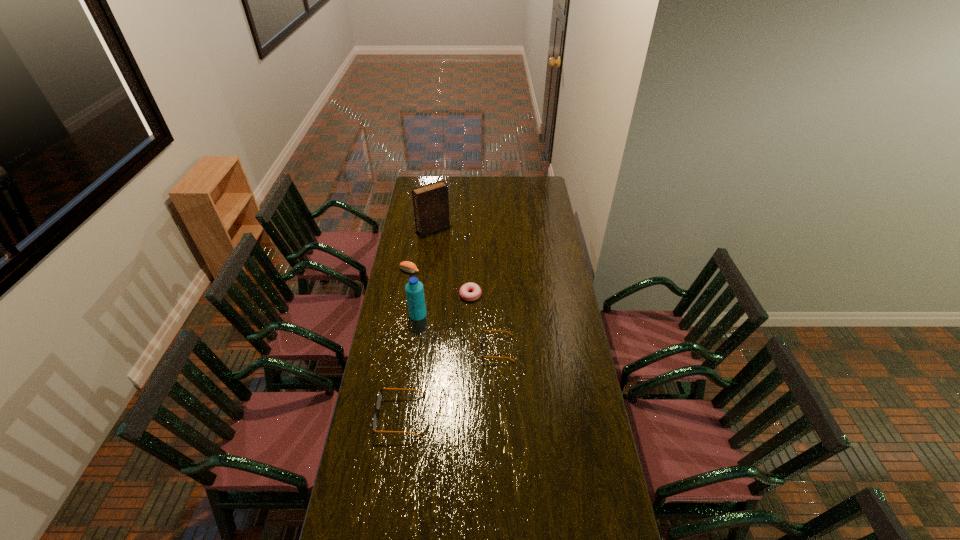
I want to click on empty space that is in between the Bible and the doughnut, so click(x=452, y=261).

You are a GUI agent. You are given a task and a screenshot of the screen. Output one action in this format:
    pyautogui.click(x=<x>, y=<y>)
    Task: Click on the vacant area that lies between the fourth farthest object and the third farthest object
    This screenshot has height=540, width=960.
    Given the screenshot: What is the action you would take?
    pyautogui.click(x=444, y=305)

The height and width of the screenshot is (540, 960). Find the location of `free space between the shorter spectacles and the third nearest object`. free space between the shorter spectacles and the third nearest object is located at coordinates (457, 331).

Point out which object is positioned as the third nearest to the left spectacles. Please provide its 2D coordinates. Your answer should be formatted as a tuple, i.e. [(x, y)], where the tuple contains the x and y coordinates of a point satisfying the conditions above.

[(463, 291)]

Select which object is the second closest to the shorter spectacles. Please provide its 2D coordinates. Your answer should be formatted as a tuple, i.e. [(x, y)], where the tuple contains the x and y coordinates of a point satisfying the conditions above.

[(379, 397)]

Where is `free space that satisfies the following two spatial constraints: 1. on the back side of the fourth nearest object; 2. on the right side of the water bottle`? The width and height of the screenshot is (960, 540). free space that satisfies the following two spatial constraints: 1. on the back side of the fourth nearest object; 2. on the right side of the water bottle is located at coordinates (420, 294).